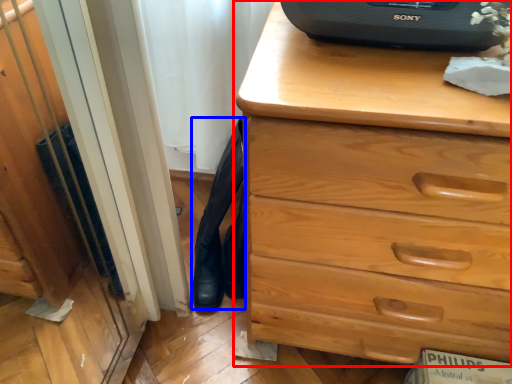
Question: Among these objects, which one is nearest to the camera, chest of drawers (highlighted by a red box) or tight (highlighted by a blue box)?

Choices:
 (A) chest of drawers
 (B) tight

Answer: (A)